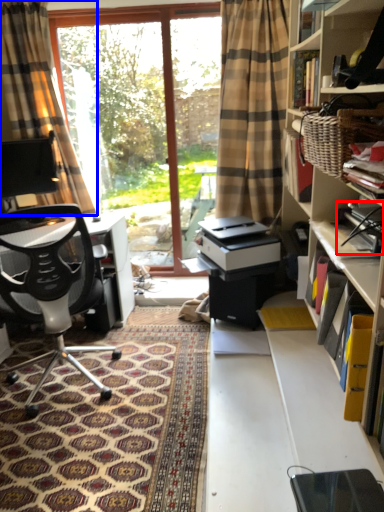
Question: Which object appears farthest to the camera in this image, book (highlighted by a red box) or curtain (highlighted by a blue box)?

Choices:
 (A) book
 (B) curtain

Answer: (B)